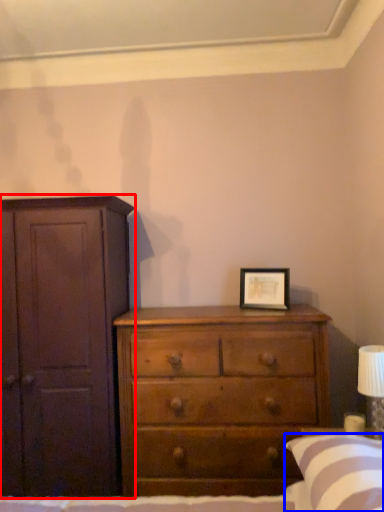
Question: Which of the following is the closest to the observer, cupboard (highlighted by a red box) or pillow (highlighted by a blue box)?

Choices:
 (A) cupboard
 (B) pillow

Answer: (B)